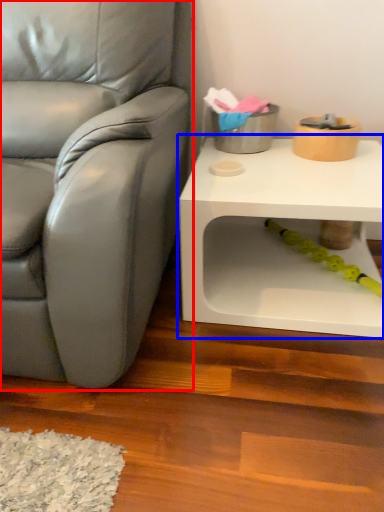
Question: Which object is further to the camera taking this photo, chair (highlighted by a red box) or table (highlighted by a blue box)?

Choices:
 (A) chair
 (B) table

Answer: (B)